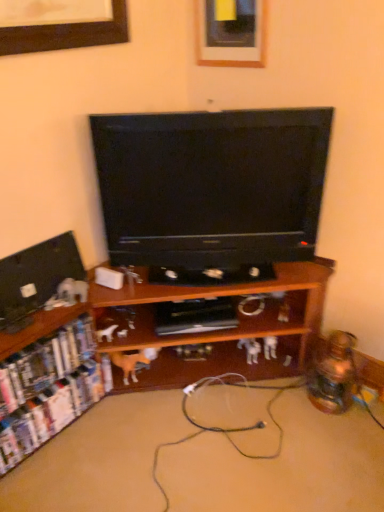
Question: Should I look upward or downward to see matte wooden picture frame at upper center?

Choices:
 (A) down
 (B) up

Answer: (B)

Question: Does white cardboard shelf at lower left, the first shelf positioned from the left, have a lesser height compared to black glossy television at center?

Choices:
 (A) yes
 (B) no

Answer: (A)

Question: Is white cardboard shelf at lower left, positioned as the second shelf in right-to-left order, positioned far away from black glossy television at center?

Choices:
 (A) no
 (B) yes

Answer: (A)

Question: Is white cardboard shelf at lower left, positioned as the second shelf in right-to-left order, bigger than black glossy television at center?

Choices:
 (A) no
 (B) yes

Answer: (A)

Question: Are white cardboard shelf at lower left, the first shelf positioned from the left, and black glossy television at center beside each other?

Choices:
 (A) yes
 (B) no

Answer: (B)

Question: Considering the relative positions of white cardboard shelf at lower left, the first shelf positioned from the left, and black glossy television at center in the image provided, is white cardboard shelf at lower left, the first shelf positioned from the left, behind black glossy television at center?

Choices:
 (A) no
 (B) yes

Answer: (B)

Question: Can you confirm if white cardboard shelf at lower left, the first shelf positioned from the left, is positioned to the right of black glossy television at center?

Choices:
 (A) no
 (B) yes

Answer: (A)

Question: From the image's perspective, would you say white cardboard shelf at lower left, the first shelf positioned from the left, is shown under black rubber extension cord at lower center?

Choices:
 (A) yes
 (B) no

Answer: (A)

Question: Is there a large distance between white cardboard shelf at lower left, positioned as the second shelf in right-to-left order, and black rubber extension cord at lower center?

Choices:
 (A) yes
 (B) no

Answer: (B)

Question: Can you confirm if white cardboard shelf at lower left, the first shelf positioned from the left, is shorter than black rubber extension cord at lower center?

Choices:
 (A) yes
 (B) no

Answer: (B)

Question: Is white cardboard shelf at lower left, positioned as the second shelf in right-to-left order, taller than black rubber extension cord at lower center?

Choices:
 (A) no
 (B) yes

Answer: (B)

Question: Does white cardboard shelf at lower left, positioned as the second shelf in right-to-left order, turn towards black rubber extension cord at lower center?

Choices:
 (A) no
 (B) yes

Answer: (A)

Question: Does white cardboard shelf at lower left, positioned as the second shelf in right-to-left order, appear on the left side of black rubber extension cord at lower center?

Choices:
 (A) no
 (B) yes

Answer: (B)

Question: Does black rubber extension cord at lower center have a lesser height compared to white cardboard shelf at lower left, positioned as the second shelf in right-to-left order?

Choices:
 (A) no
 (B) yes

Answer: (B)